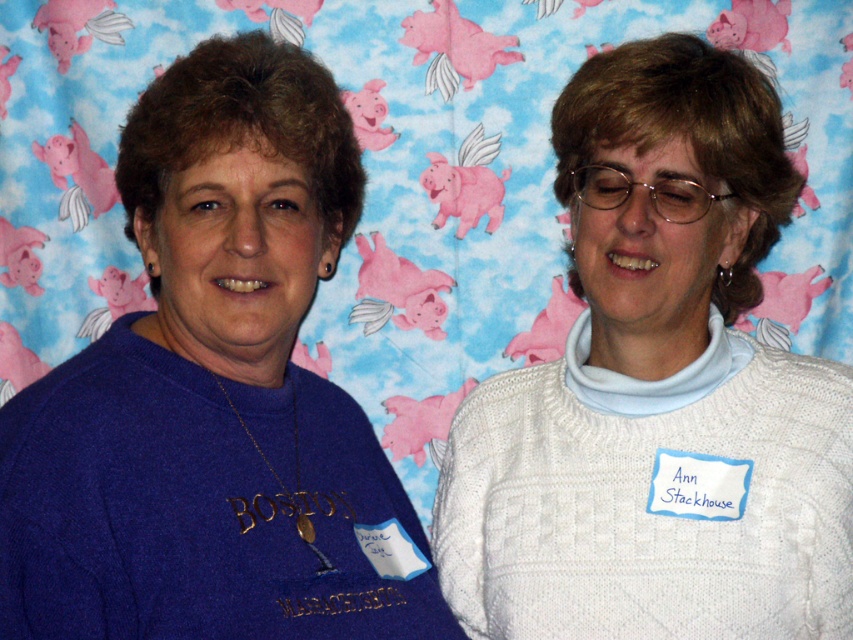
Question: Is the position of white knitted sweater at center less distant than that of matte blue sweater at left?

Choices:
 (A) yes
 (B) no

Answer: (B)

Question: Which point appears closest to the camera in this image?

Choices:
 (A) (467, 534)
 (B) (223, 570)

Answer: (B)

Question: Is white knitted sweater at center to the right of matte blue sweater at left from the viewer's perspective?

Choices:
 (A) no
 (B) yes

Answer: (B)

Question: Which object is closer to the camera taking this photo?

Choices:
 (A) white knitted sweater at center
 (B) matte blue sweater at left

Answer: (B)

Question: Can you confirm if white knitted sweater at center is wider than matte blue sweater at left?

Choices:
 (A) no
 (B) yes

Answer: (B)

Question: Among these points, which one is farthest from the camera?

Choices:
 (A) (212, 374)
 (B) (805, 426)

Answer: (B)